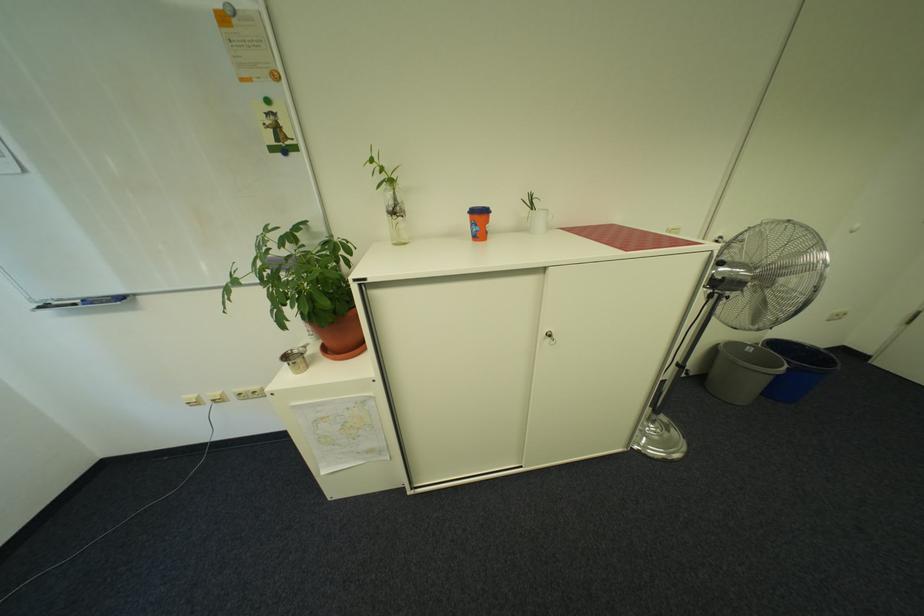
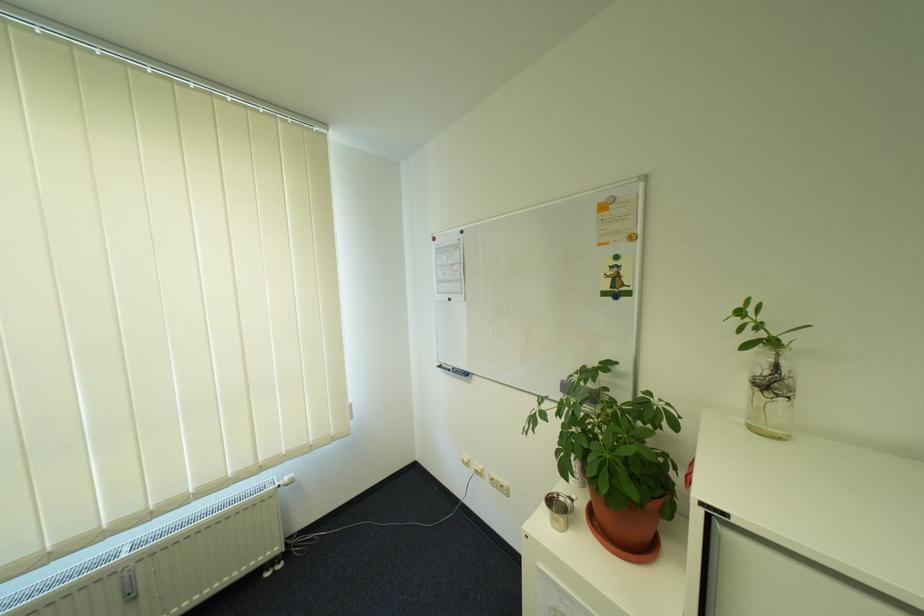
In the second image, find the point that corresponds to pixel 83 306 in the first image.

(458, 371)